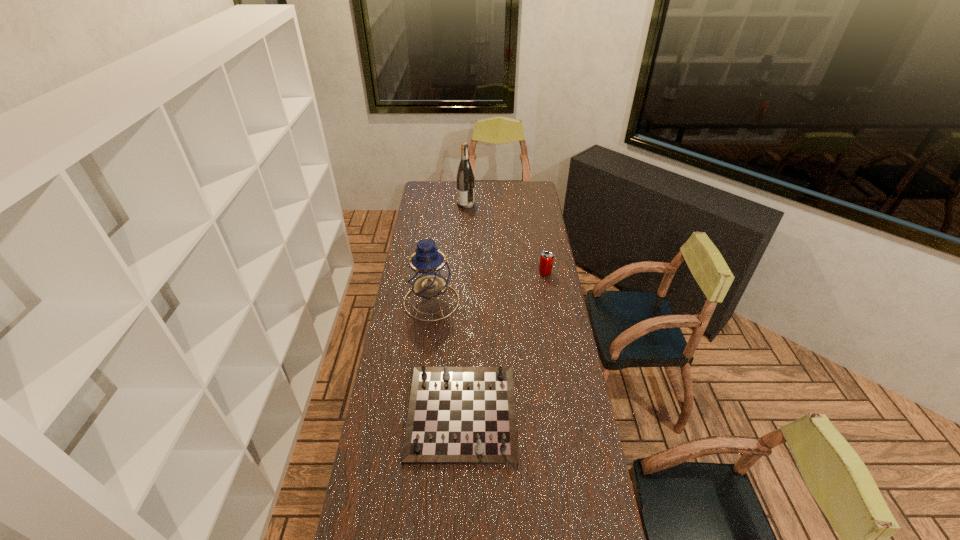
You are a GUI agent. You are given a task and a screenshot of the screen. Output one action in this format:
    pyautogui.click(x=<x>, y=<y>)
    Task: Click on the farthest object
    The height and width of the screenshot is (540, 960).
    Given the screenshot: What is the action you would take?
    pyautogui.click(x=465, y=178)

Find the location of a particular element. The width and height of the screenshot is (960, 540). lantern is located at coordinates (428, 273).

This screenshot has height=540, width=960. I want to click on the rightmost object, so click(x=546, y=258).

What are the coordinates of `the second farthest object` in the screenshot? It's located at (546, 258).

The width and height of the screenshot is (960, 540). Find the location of `chessboard`. chessboard is located at coordinates (457, 415).

At what (x,y) coordinates should I click in order to perform the action: click on the nearest object. Please return your answer as a coordinate pair (x, y). The height and width of the screenshot is (540, 960). Looking at the image, I should click on (457, 415).

The height and width of the screenshot is (540, 960). What are the coordinates of `vacant space located 0.190m on the back of the farthest object` in the screenshot? It's located at (467, 184).

Locate an element on the screen. vacant space located 0.280m on the front-facing side of the lantern is located at coordinates (422, 374).

Image resolution: width=960 pixels, height=540 pixels. What are the coordinates of `free spot located on the left of the third nearest object` in the screenshot? It's located at (510, 273).

Locate an element on the screen. free space located 0.220m on the board of the chessboard is located at coordinates (458, 538).